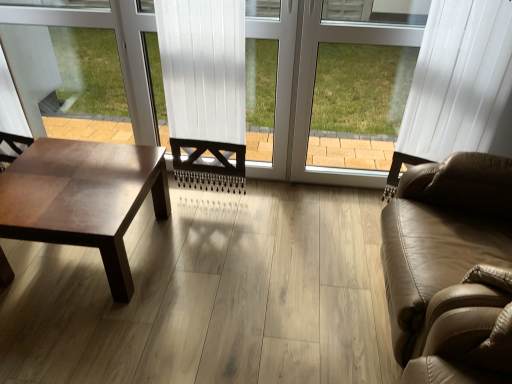
Question: Would you consider shiny brown wood coffee table at left to be distant from tan leather couch at right?

Choices:
 (A) yes
 (B) no

Answer: (A)

Question: Is shiny brown wood coffee table at left to the left of tan leather couch at right from the viewer's perspective?

Choices:
 (A) no
 (B) yes

Answer: (B)

Question: Is shiny brown wood coffee table at left looking in the opposite direction of tan leather couch at right?

Choices:
 (A) yes
 (B) no

Answer: (B)

Question: From a real-world perspective, is shiny brown wood coffee table at left on top of tan leather couch at right?

Choices:
 (A) yes
 (B) no

Answer: (B)

Question: Is shiny brown wood coffee table at left thinner than tan leather couch at right?

Choices:
 (A) no
 (B) yes

Answer: (B)

Question: From the image's perspective, is shiny brown wood coffee table at left above tan leather couch at right?

Choices:
 (A) yes
 (B) no

Answer: (A)

Question: Is the depth of white plastic window frame at center greater than that of shiny brown wood coffee table at left?

Choices:
 (A) yes
 (B) no

Answer: (A)

Question: Is white plastic window frame at center facing towards shiny brown wood coffee table at left?

Choices:
 (A) yes
 (B) no

Answer: (B)

Question: Considering the relative positions of white plastic window frame at center and shiny brown wood coffee table at left in the image provided, is white plastic window frame at center to the left of shiny brown wood coffee table at left from the viewer's perspective?

Choices:
 (A) no
 (B) yes

Answer: (A)

Question: From a real-world perspective, is white plastic window frame at center physically below shiny brown wood coffee table at left?

Choices:
 (A) no
 (B) yes

Answer: (A)

Question: Is shiny brown wood coffee table at left a part of white plastic window frame at center?

Choices:
 (A) no
 (B) yes

Answer: (A)

Question: Considering the relative sizes of white plastic window frame at center and shiny brown wood coffee table at left in the image provided, is white plastic window frame at center shorter than shiny brown wood coffee table at left?

Choices:
 (A) no
 (B) yes

Answer: (A)

Question: Considering the relative sizes of white plastic window frame at center and tan leather couch at right in the image provided, is white plastic window frame at center bigger than tan leather couch at right?

Choices:
 (A) yes
 (B) no

Answer: (B)